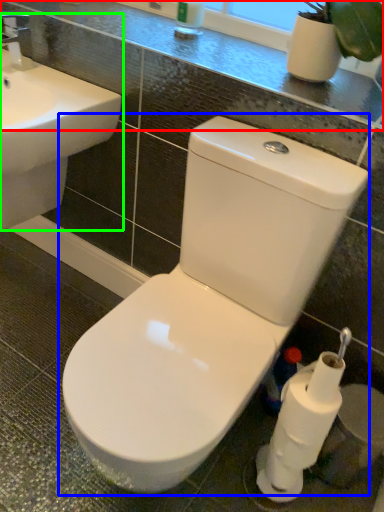
Question: Considering the real-world distances, which object is closest to counter top (highlighted by a red box)? toilet (highlighted by a blue box) or sink (highlighted by a green box).

Choices:
 (A) toilet
 (B) sink

Answer: (B)